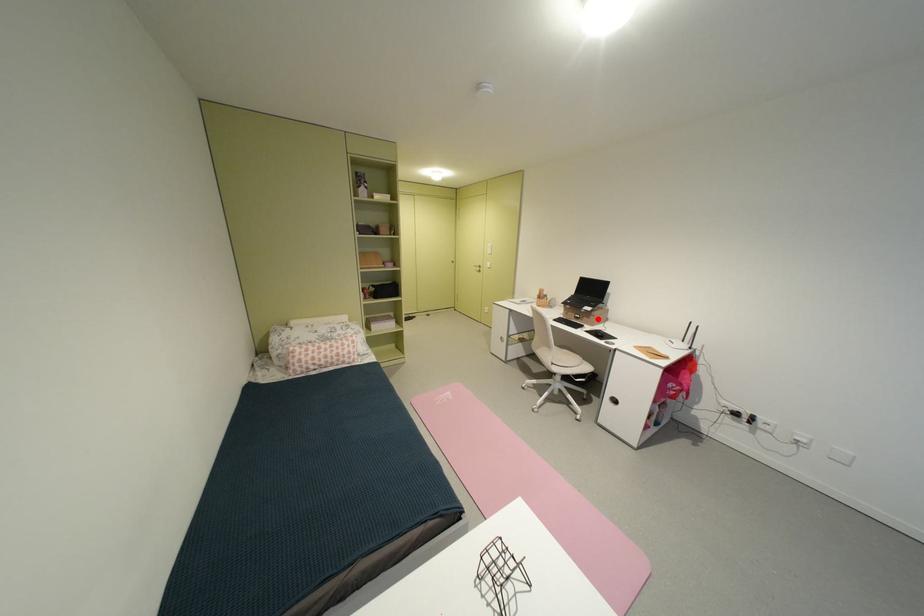
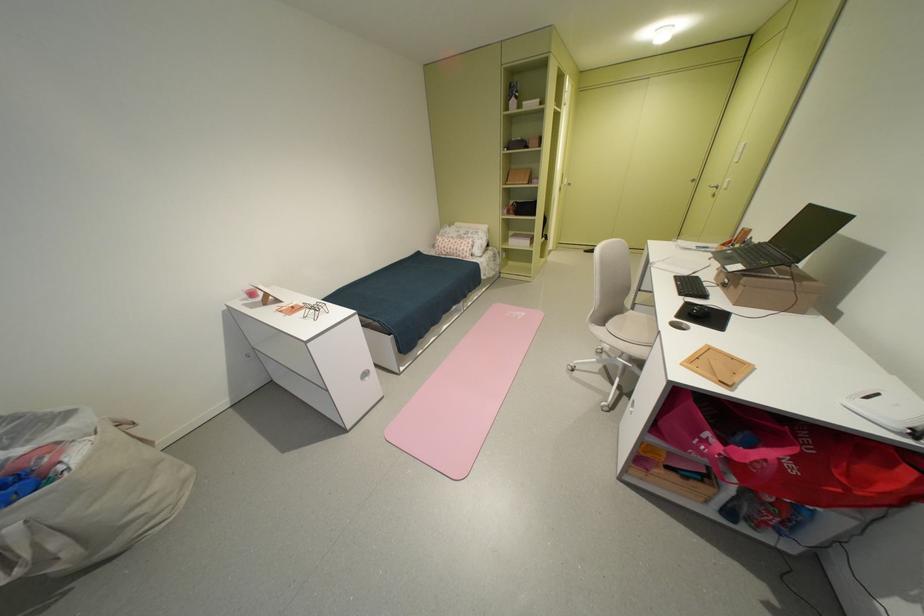
Where in the second image is the point corresponding to the highlighted location from the first image?

(746, 288)